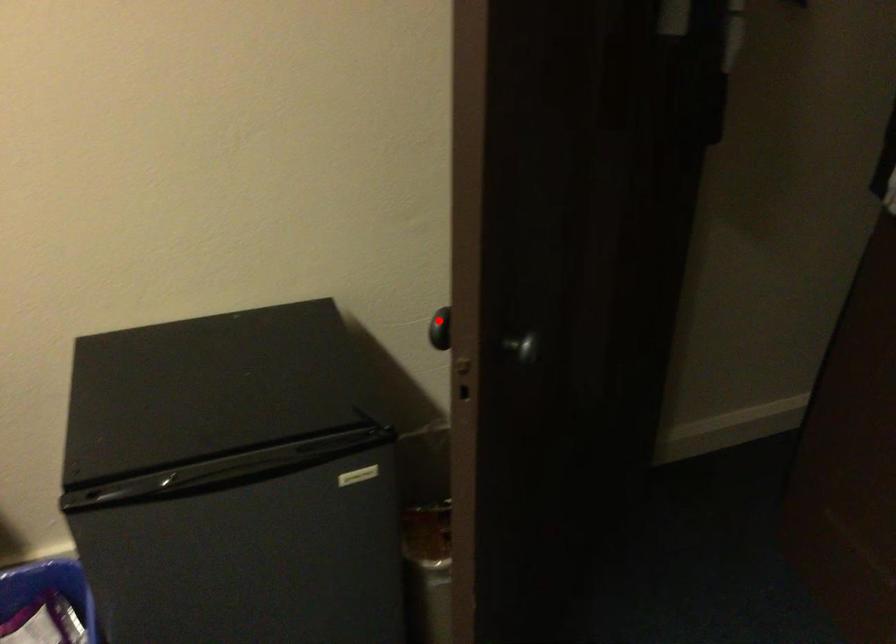
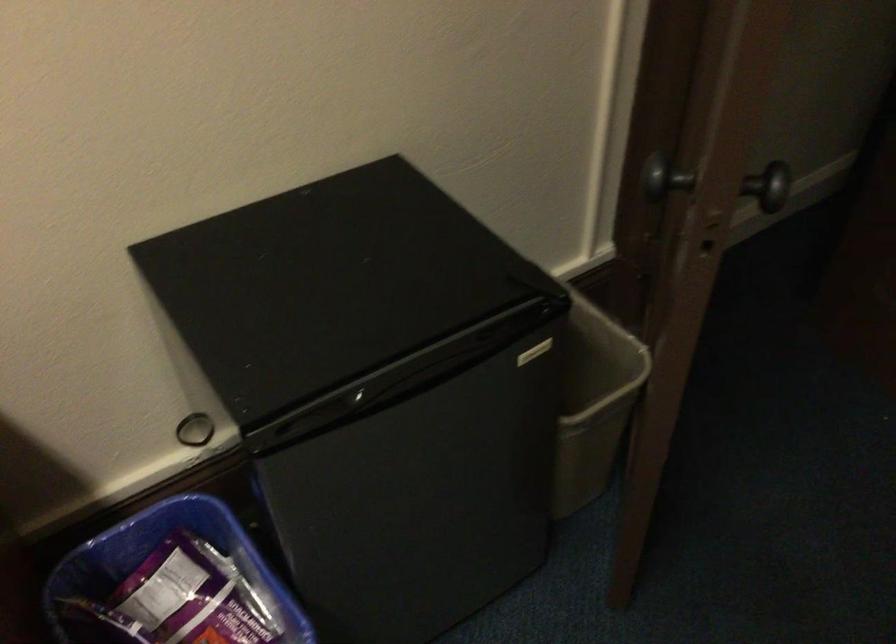
Where in the second image is the point corresponding to the highlighted location from the first image?

(656, 174)